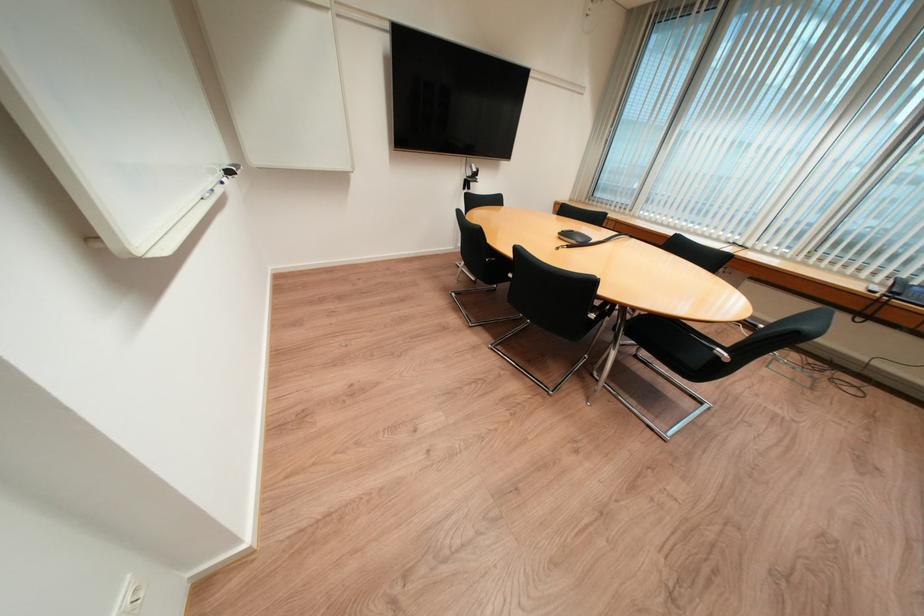
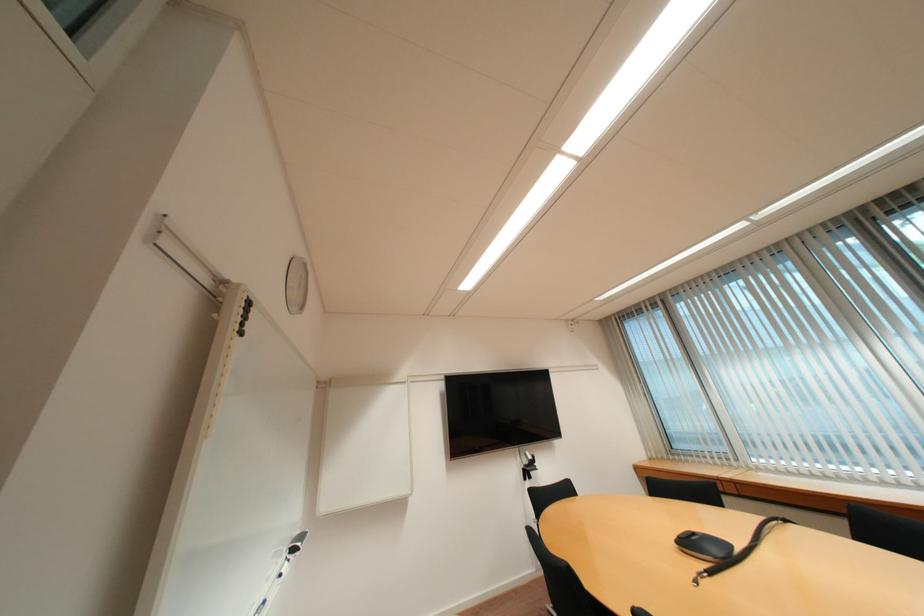
Question: How did the camera likely rotate?

Choices:
 (A) Left
 (B) Right
 (C) Up
 (D) Down

Answer: (C)